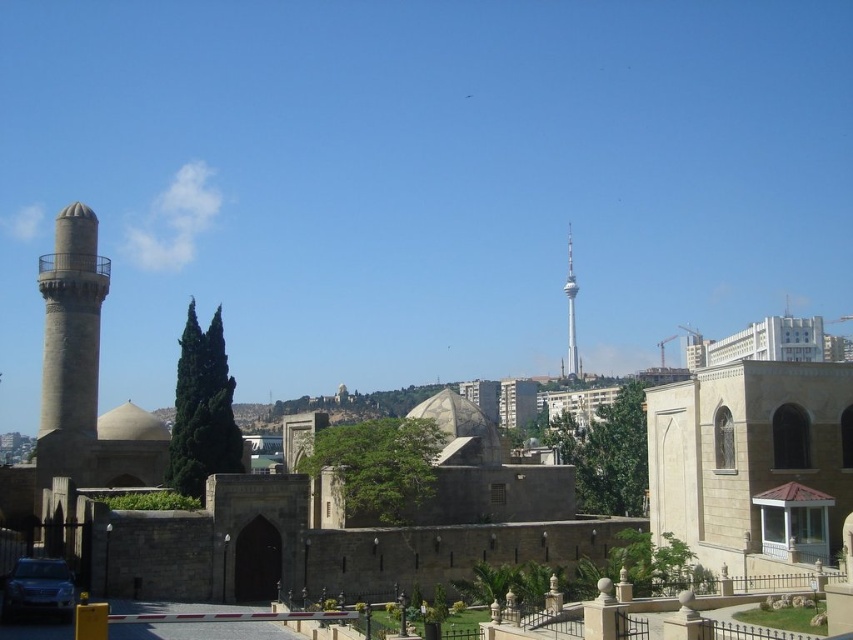
You are a tourist standing in front of the gray stone minaret at left and the smooth silver tower at upper center. You want to take a photo that includes both objects in the frame. Which object should you position closer to the camera to ensure both are visible?

You should position the gray stone minaret at left closer to the camera because it is positioned over the smooth silver tower at upper center, meaning it is closer to the viewer. By placing it nearer, both objects will be in the frame without one being obscured.

You are a photographer planning to capture the silver metallic car at lower left and the smooth silver tower at upper center in a single frame. Given their sizes in the image, which object will appear smaller in the final photo?

The silver metallic car at lower left will appear smaller in the final photo because it occupies less space than the smooth silver tower at upper center according to the description.